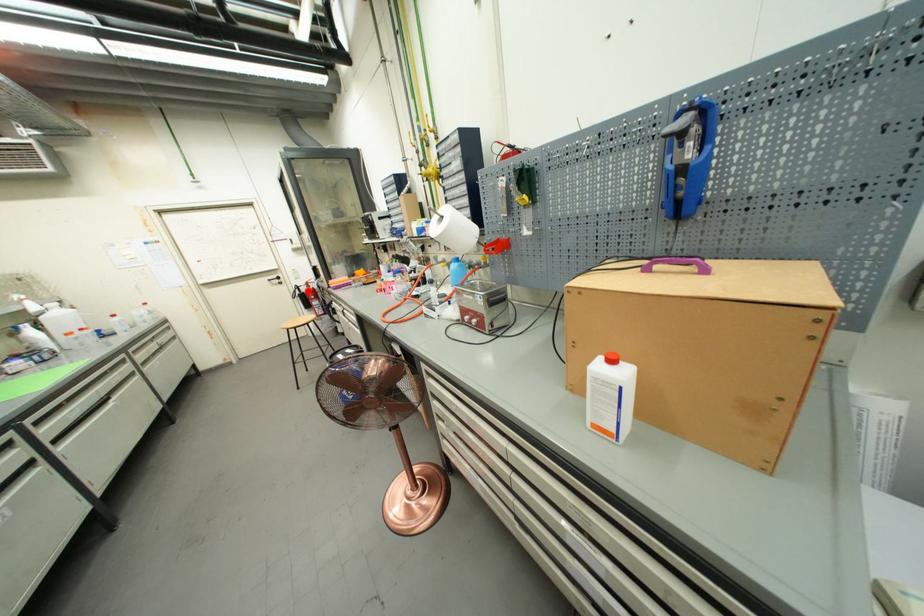
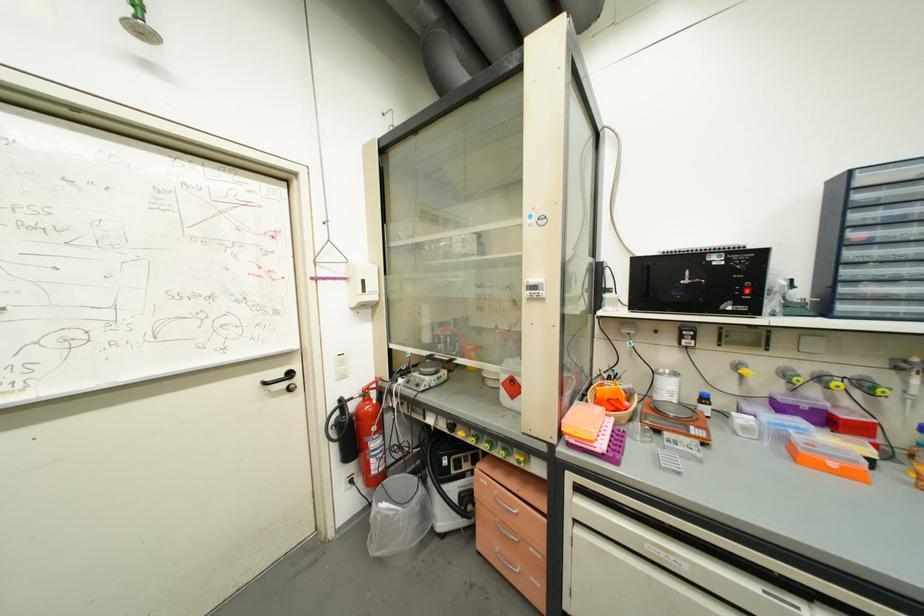
Find the pixel in the second image that matches the highlighted location in the first image.

(358, 408)